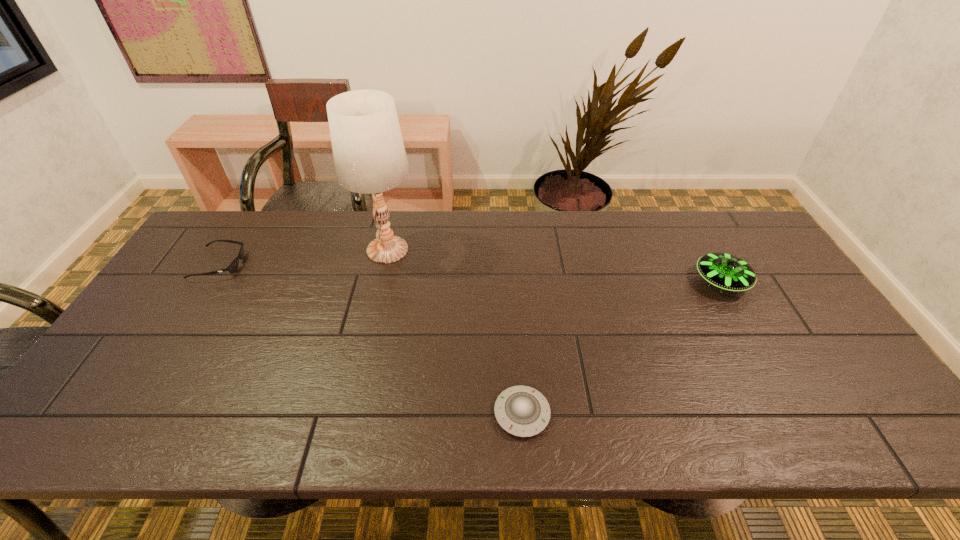
You are a GUI agent. You are given a task and a screenshot of the screen. Output one action in this format:
    pyautogui.click(x=<x>, y=<y>)
    Task: Click on the free space at the right edge of the desktop
    The image size is (960, 540).
    Given the screenshot: What is the action you would take?
    pyautogui.click(x=771, y=324)

Locate an element on the screen. vacant space at the far left corner of the desktop is located at coordinates (225, 231).

The height and width of the screenshot is (540, 960). In the image, there is a desktop. What are the coordinates of `vacant space at the near right corner` in the screenshot? It's located at (865, 421).

In order to click on free area in between the second object from left to right and the leftmost object in this screenshot , I will do `click(303, 257)`.

I want to click on vacant area between the leftmost object and the lamp, so click(x=303, y=257).

Find the location of a particular element. This screenshot has height=540, width=960. empty location between the right saucer and the left saucer is located at coordinates (621, 347).

At what (x,y) coordinates should I click in order to perform the action: click on free space between the lamp and the shortest object. Please return your answer as a coordinate pair (x, y). Image resolution: width=960 pixels, height=540 pixels. Looking at the image, I should click on (455, 332).

Identify the location of free space between the taller saucer and the leftmost object. This screenshot has width=960, height=540. pos(470,273).

What are the coordinates of `free area in between the leftmost object and the lamp` in the screenshot? It's located at (303, 257).

This screenshot has height=540, width=960. What are the coordinates of `free space between the third tallest object and the farther saucer` in the screenshot? It's located at (470, 273).